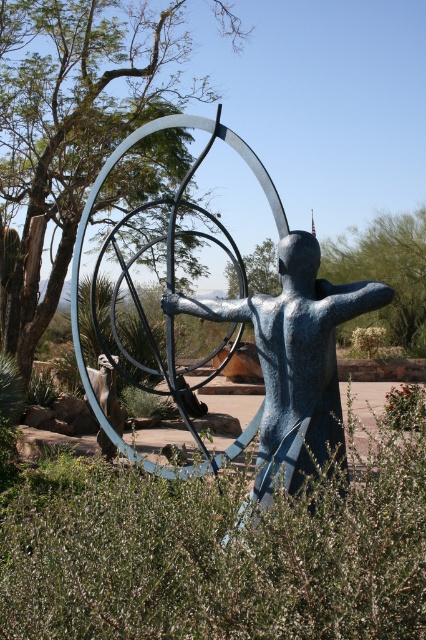
Based on the scene description, what object is positioned at the coordinates point (x=218, y=552)?

The green leafy bush at center is located at point (x=218, y=552).

You are standing in front of the sculpture and notice two green leafy trees in the background. Which tree is closer to you, the green leafy tree at upper left or the green leafy tree at upper right?

A: The green leafy tree at upper left is closer to you because it is in front of the green leafy tree at upper right.

You are standing at the center of the desert and want to locate the blue polished metal statue at center. According to the coordinates provided, in which direction should you move to reach it?

The blue polished metal statue at center is located at coordinates point [294,358]. Since you are at the center, which is typically considered as point [0,0], you should move towards the northeast direction to reach it.